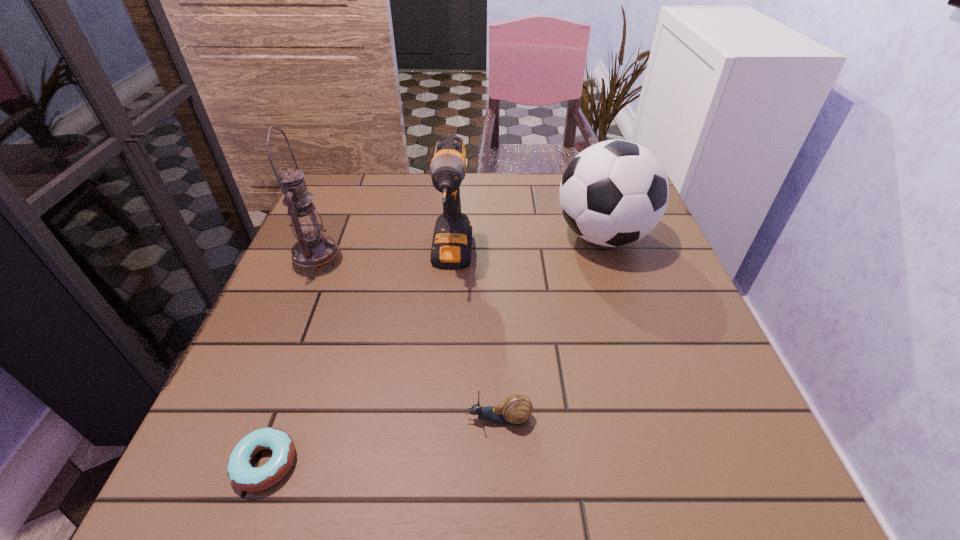
At what (x,y) coordinates should I click in order to perform the action: click on vacant space that satisfies the following two spatial constraints: 1. on the back side of the shortest object; 2. on the left side of the rightmost object. Please return your answer as a coordinate pair (x, y). Looking at the image, I should click on (347, 236).